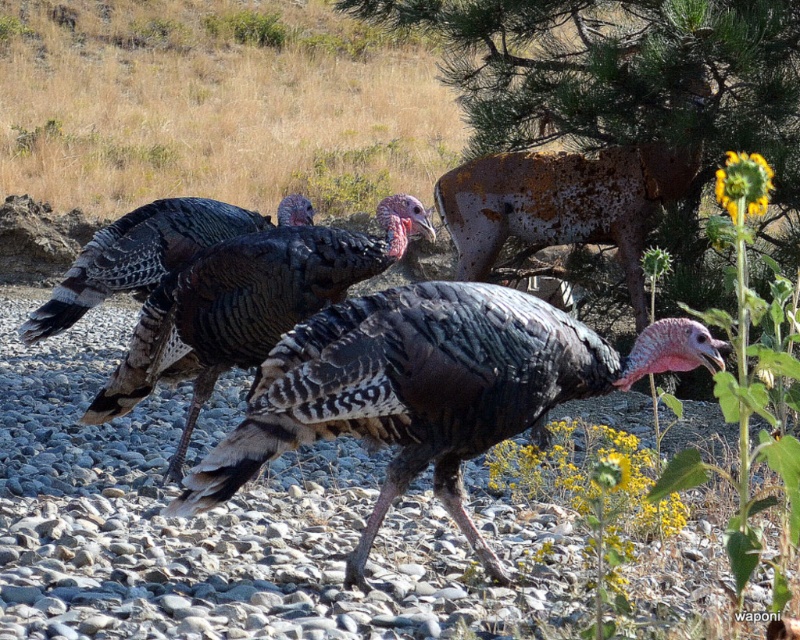
Question: Is shiny black turkey at center smaller than shiny black feathers at center?

Choices:
 (A) yes
 (B) no

Answer: (A)

Question: Which point appears farthest from the camera in this image?

Choices:
 (A) (197, 275)
 (B) (422, 284)

Answer: (A)

Question: Does shiny black turkey at center have a greater width compared to shiny black feathers at center?

Choices:
 (A) no
 (B) yes

Answer: (B)

Question: Is shiny black turkey at center to the right of shiny black feathers at center from the viewer's perspective?

Choices:
 (A) no
 (B) yes

Answer: (B)

Question: Which of the following is the farthest from the observer?

Choices:
 (A) (393, 433)
 (B) (256, 250)

Answer: (B)